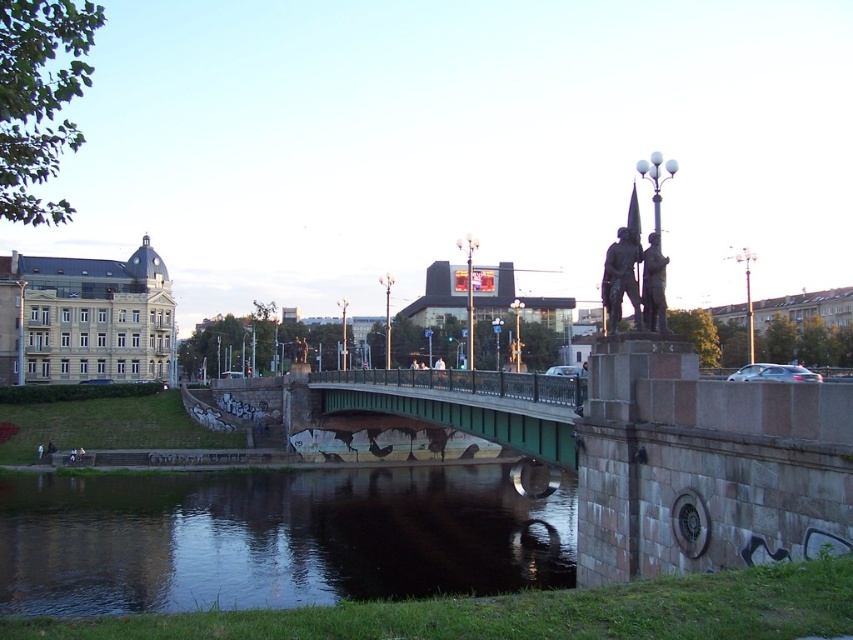
Can you confirm if dark reflective water at center is positioned to the left of bronze statue at center?

Correct, you'll find dark reflective water at center to the left of bronze statue at center.

You are a GUI agent. You are given a task and a screenshot of the screen. Output one action in this format:
    pyautogui.click(x=<x>, y=<y>)
    Task: Click on the dark reflective water at center
    The image size is (853, 640).
    Given the screenshot: What is the action you would take?
    pyautogui.click(x=273, y=538)

Between point (126, 540) and point (645, 262), which one is positioned behind?

Positioned behind is point (126, 540).

Locate an element on the screen. This screenshot has height=640, width=853. dark reflective water at center is located at coordinates (273, 538).

Does green painted metal bridge at center appear under bronze statue at upper right?

Yes.

Can you confirm if green painted metal bridge at center is taller than bronze statue at upper right?

Correct, green painted metal bridge at center is much taller as bronze statue at upper right.

Where is `green painted metal bridge at center`? green painted metal bridge at center is located at coordinates (468, 404).